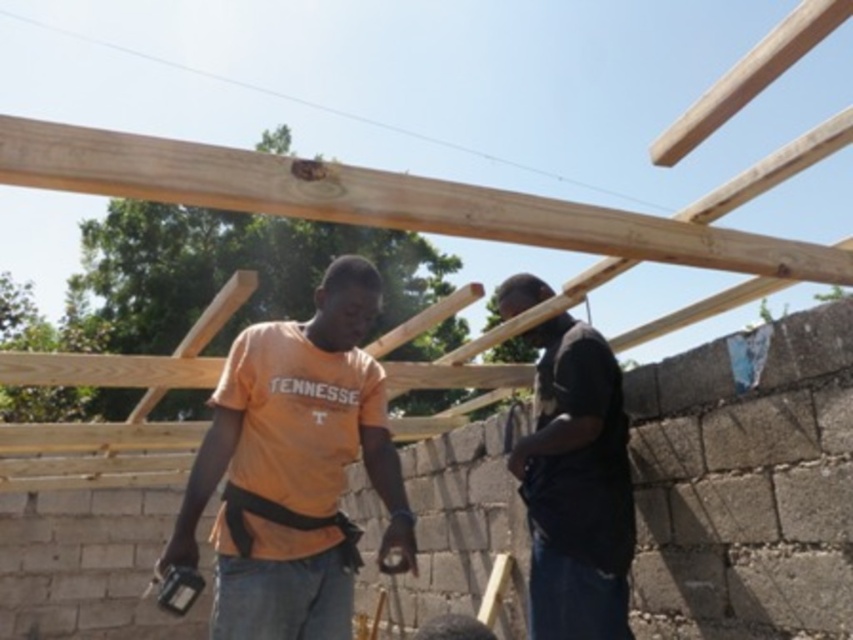
You are a construction worker standing at the point marked by the coordinates point (381, 198). You need to move to the nearest wooden beam. Which direction should you go?

The point marked by point (381, 198) is already at the natural wood beam at upper center, so you are already at the wooden beam.

You are a safety inspector at a construction site. You need to ensure that the orange cotton shirt at center and the black matte shirt at center are visible to each other for safety. Based on their sizes, which shirt might be harder to see from a distance?

The orange cotton shirt at center occupies less space than the black matte shirt at center, so the orange cotton shirt at center might be harder to see from a distance because it is smaller in size.